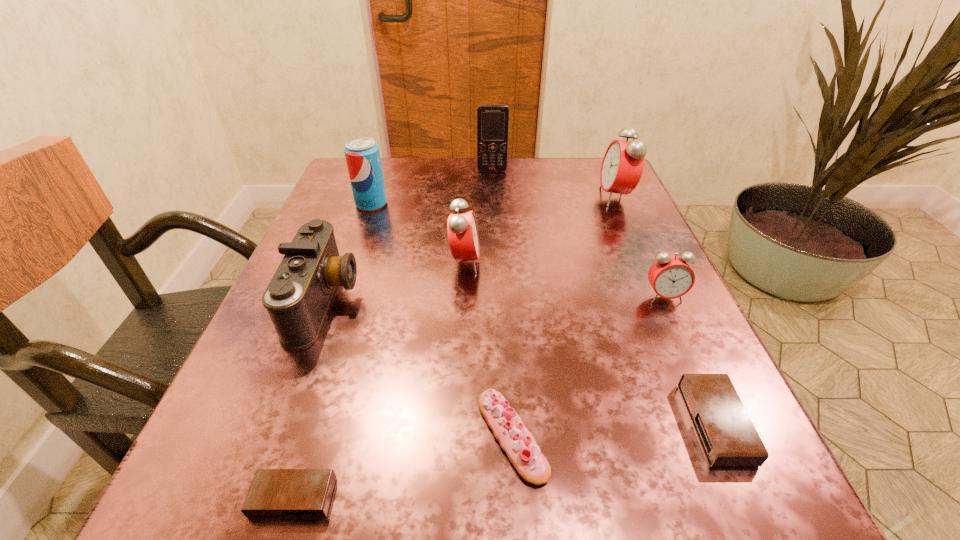
I want to click on eclair at the near edge, so click(x=514, y=438).

Locate an element on the screen. soda can situated at the left edge is located at coordinates 362,155.

What are the coordinates of `camera that is at the left edge` in the screenshot? It's located at (298, 297).

At what (x,y) coordinates should I click in order to perform the action: click on alarm clock at the left edge. Please return your answer as a coordinate pair (x, y). This screenshot has height=540, width=960. Looking at the image, I should click on (274, 493).

I want to click on object that is positioned at the far left corner, so click(x=362, y=155).

You are a GUI agent. You are given a task and a screenshot of the screen. Output one action in this format:
    pyautogui.click(x=<x>, y=<y>)
    Task: Click on the object situated at the near left corner
    This screenshot has width=960, height=540.
    Given the screenshot: What is the action you would take?
    pyautogui.click(x=274, y=493)

Find the location of `object that is at the far right corner`. object that is at the far right corner is located at coordinates click(623, 163).

Where is `object positioned at the near right corner`? This screenshot has width=960, height=540. object positioned at the near right corner is located at coordinates (728, 437).

This screenshot has height=540, width=960. Identify the location of free location at the far edge of the desktop. (513, 164).

This screenshot has width=960, height=540. What are the coordinates of `free region at the near edge of the desktop` in the screenshot? It's located at (416, 487).